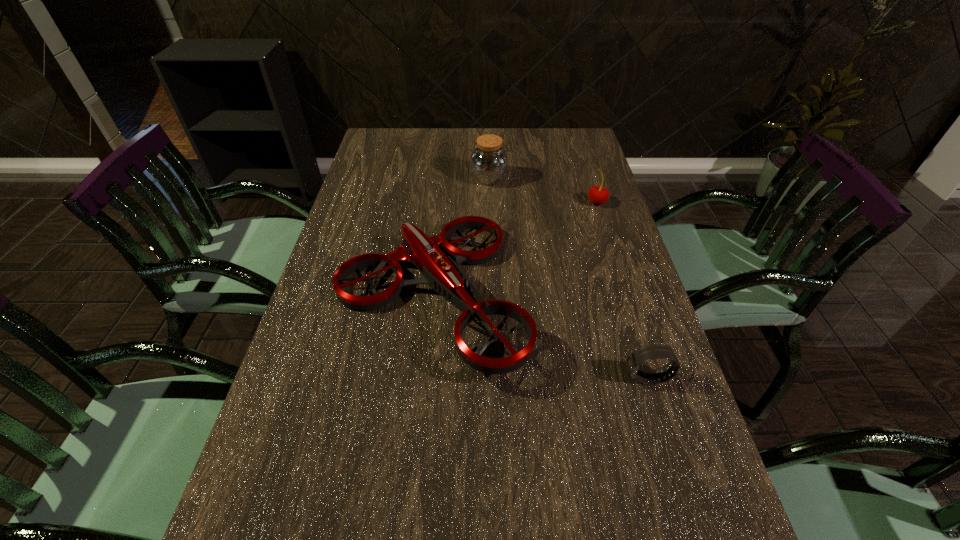
The width and height of the screenshot is (960, 540). In order to click on the farthest object in this screenshot , I will do `click(489, 161)`.

This screenshot has height=540, width=960. I want to click on the third nearest object, so click(x=598, y=195).

Where is `drone`? The width and height of the screenshot is (960, 540). drone is located at coordinates (440, 271).

You are a GUI agent. You are given a task and a screenshot of the screen. Output one action in this format:
    pyautogui.click(x=<x>, y=<y>)
    Task: Click on the watch
    The width and height of the screenshot is (960, 540).
    Given the screenshot: What is the action you would take?
    pyautogui.click(x=636, y=358)

The width and height of the screenshot is (960, 540). I want to click on free space located 0.330m on the front of the jar, so click(491, 258).

This screenshot has height=540, width=960. Find the location of `vacant space located on the front of the second farthest object`. vacant space located on the front of the second farthest object is located at coordinates (606, 231).

Locate an element on the screen. blank space located 0.320m on the back of the drone is located at coordinates (444, 168).

The width and height of the screenshot is (960, 540). What are the coordinates of `free region located on the face of the watch` in the screenshot? It's located at (479, 378).

The image size is (960, 540). Identify the location of free space located 0.190m on the face of the watch. (536, 378).

You are a GUI agent. You are given a task and a screenshot of the screen. Output one action in this format:
    pyautogui.click(x=<x>, y=<y>)
    Task: Click on the vacant space located on the face of the watch
    
    Given the screenshot: What is the action you would take?
    pyautogui.click(x=578, y=378)